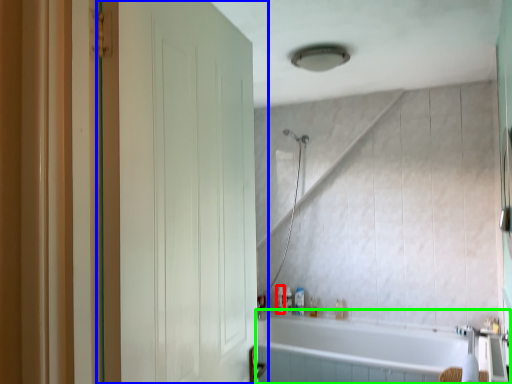
Question: Based on their relative distances, which object is nearer to toiletry (highlighted by a red box)? Choose from door (highlighted by a blue box) and bathtub (highlighted by a green box).

Choices:
 (A) door
 (B) bathtub

Answer: (B)